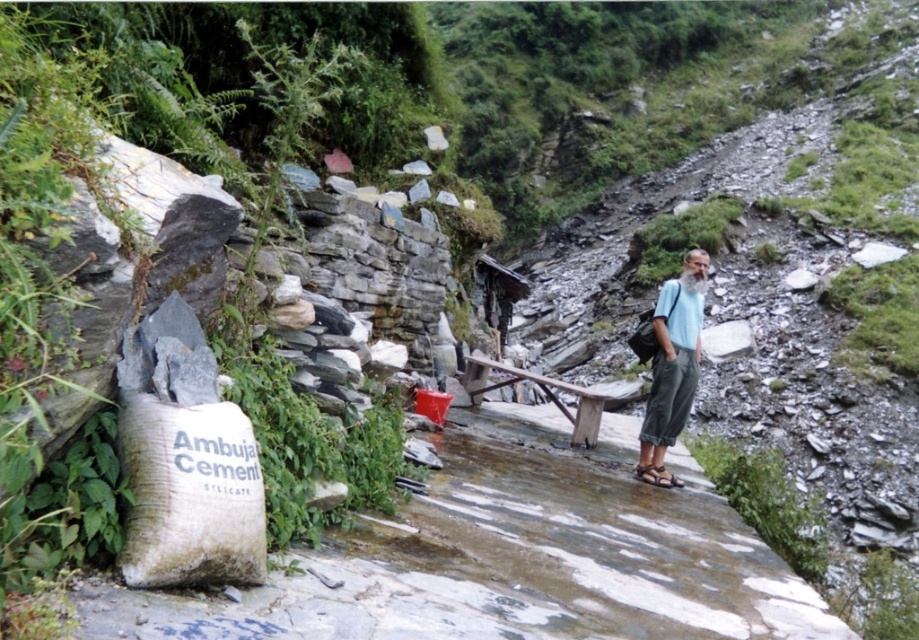
Question: Which point is farther to the camera?

Choices:
 (A) light blue fabric shirt at right
 (B) white stone path at center

Answer: (A)

Question: Can you confirm if white stone path at center is bigger than light blue fabric shirt at right?

Choices:
 (A) no
 (B) yes

Answer: (A)

Question: Is white stone path at center smaller than light blue fabric shirt at right?

Choices:
 (A) no
 (B) yes

Answer: (B)

Question: Does white stone path at center appear under light blue fabric shirt at right?

Choices:
 (A) no
 (B) yes

Answer: (B)

Question: Which point appears closest to the camera in this image?

Choices:
 (A) tap(338, 582)
 (B) tap(691, 356)

Answer: (A)

Question: Which of the following is the closest to the observer?

Choices:
 (A) (684, 504)
 (B) (694, 355)

Answer: (A)